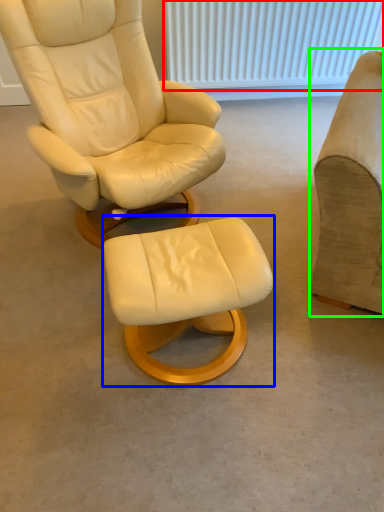
Question: Which object is positioned farthest from radiator (highlighted by a red box)? Select from stool (highlighted by a blue box) and chair (highlighted by a green box).

Choices:
 (A) stool
 (B) chair

Answer: (A)